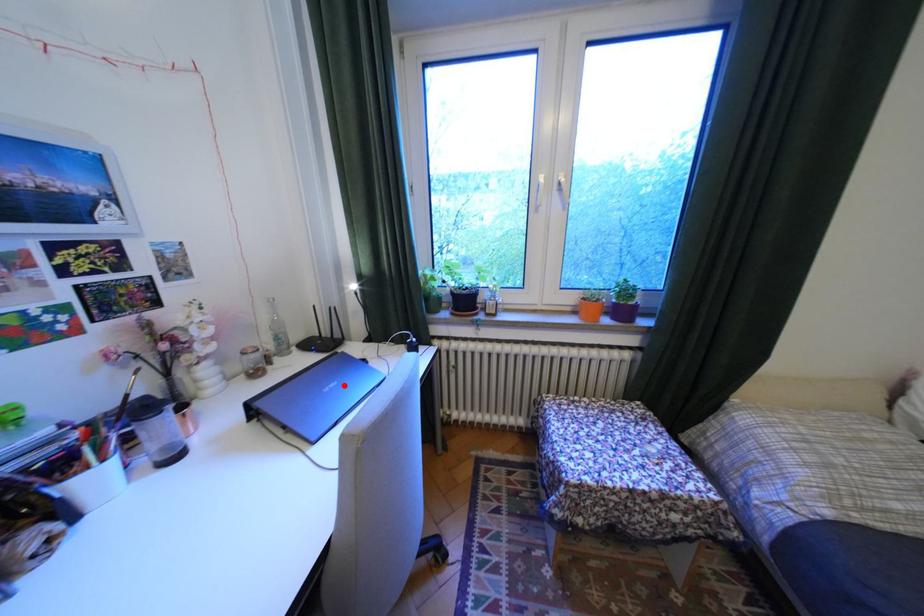
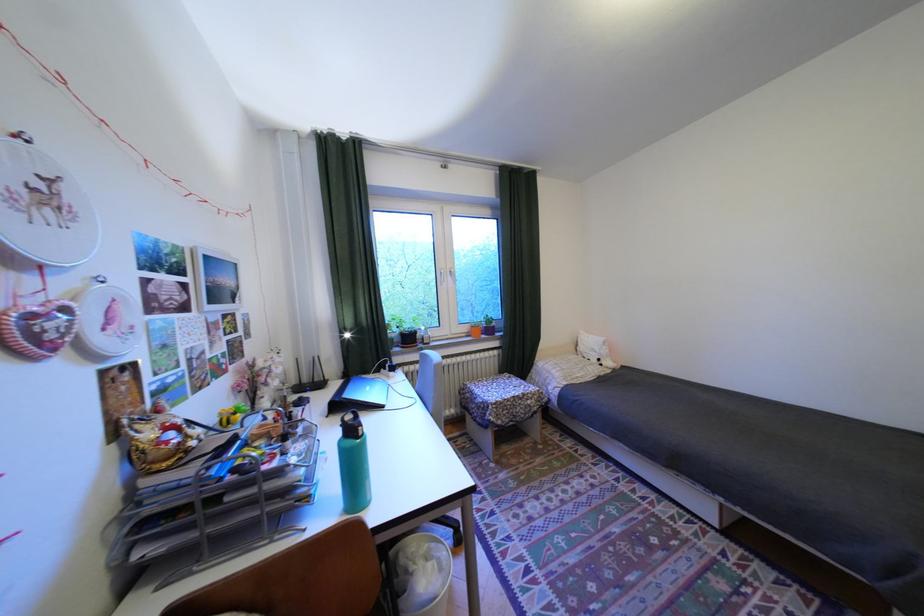
The point at the highlighted location is marked in the first image. Where is the corresponding point in the second image?

(380, 387)